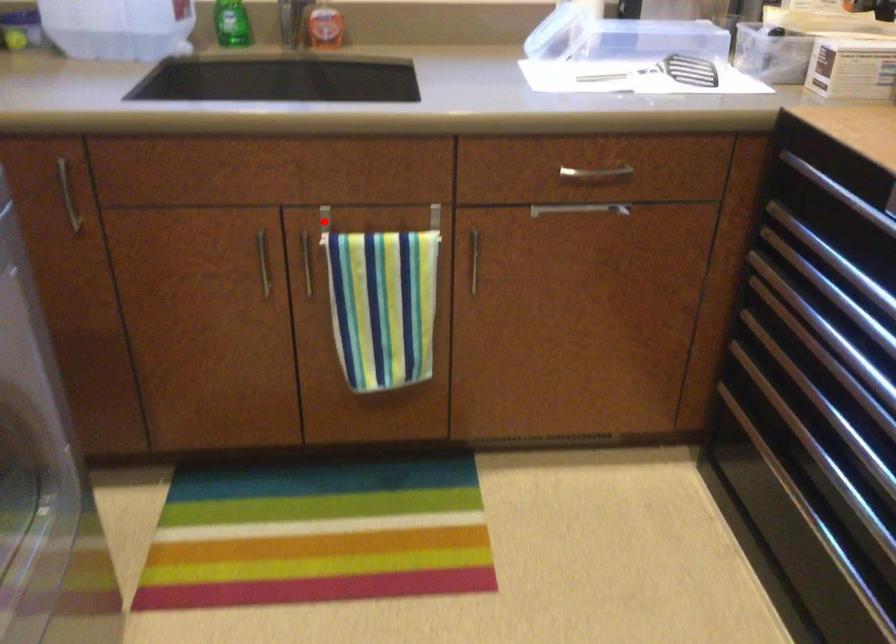
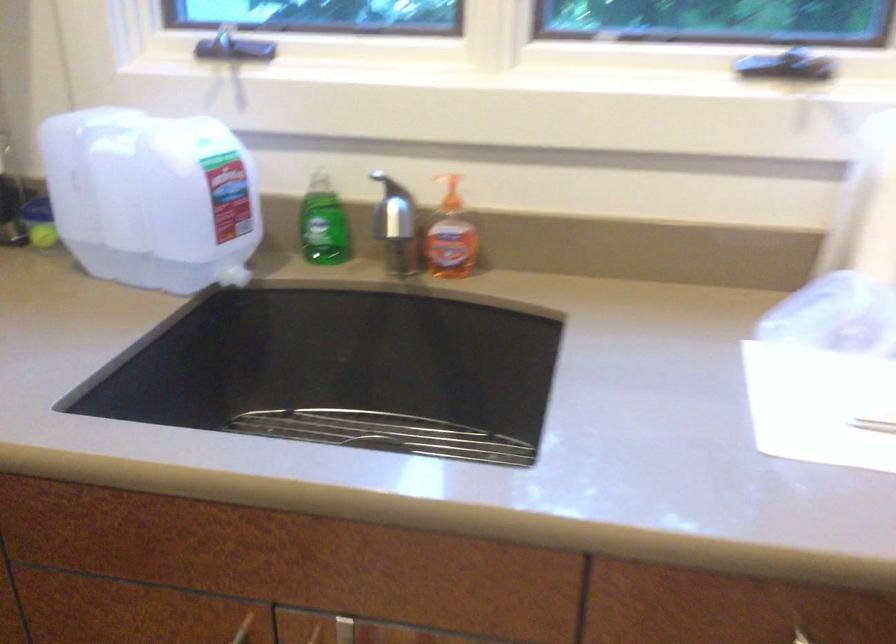
The point at the highlighted location is marked in the first image. Where is the corresponding point in the second image?

(343, 630)